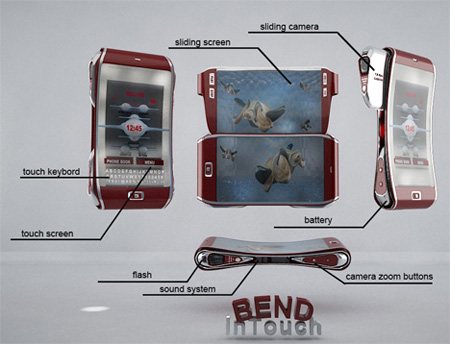
This screenshot has height=344, width=450. Identify the location of keypad. coord(123,174).